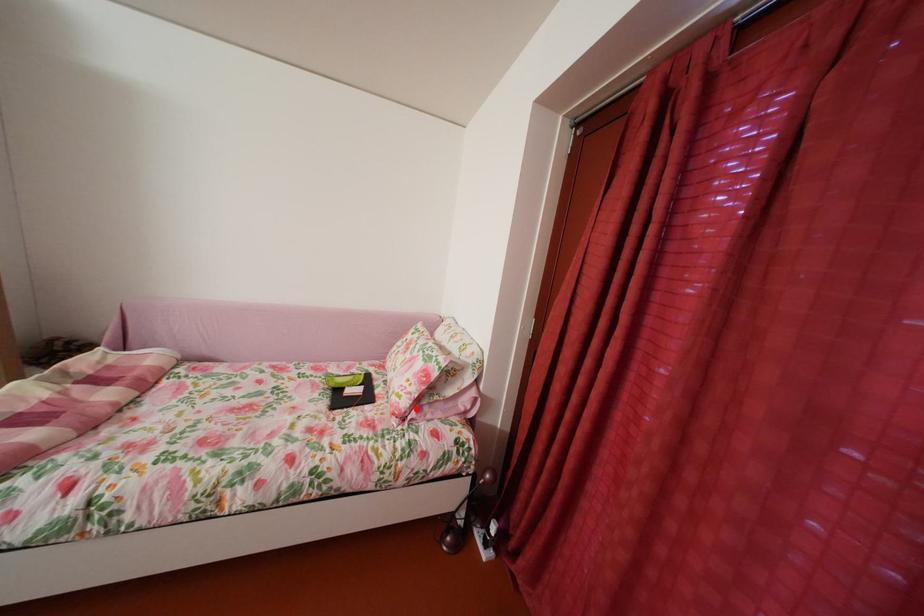
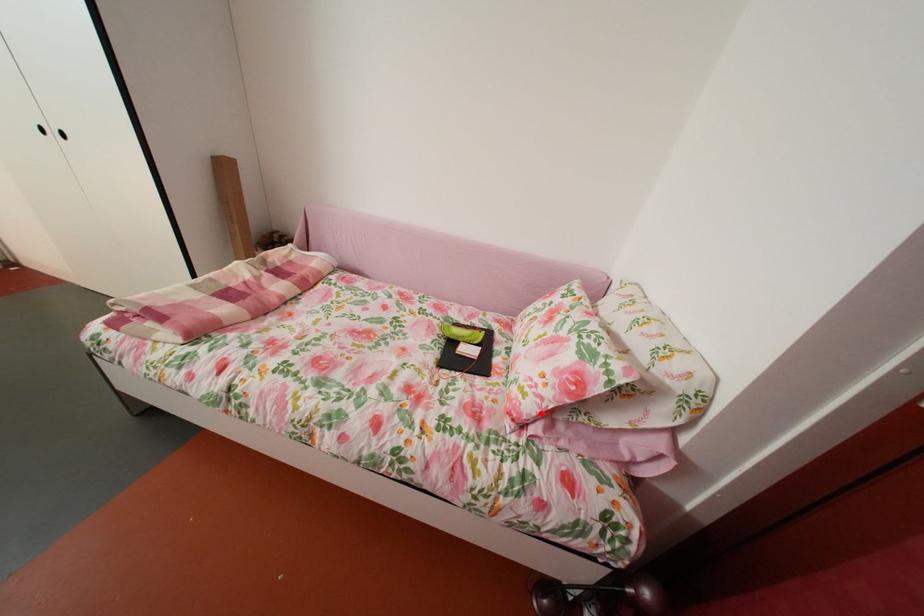
I am providing you with two images of the same scene from different viewpoints. A red point is marked on the first image and another point is marked on the second image. Are the points marked in image1 and image2 representing the same 3D position?

Yes